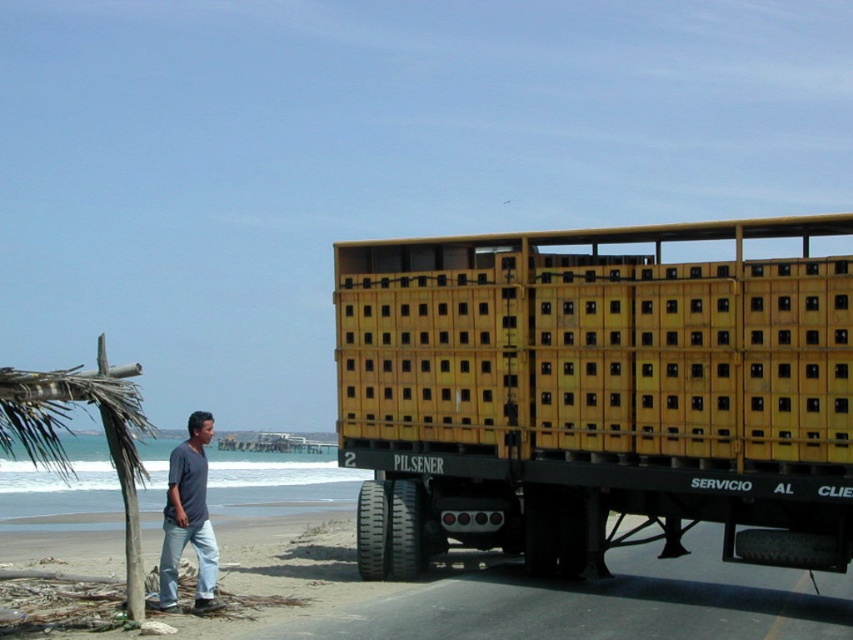
You are standing at the point marked by the coordinate point at (596, 394). What object are you standing on?

The point at (596, 394) marks the yellow matte trailer truck at center, so you are standing on the yellow matte trailer truck at center.